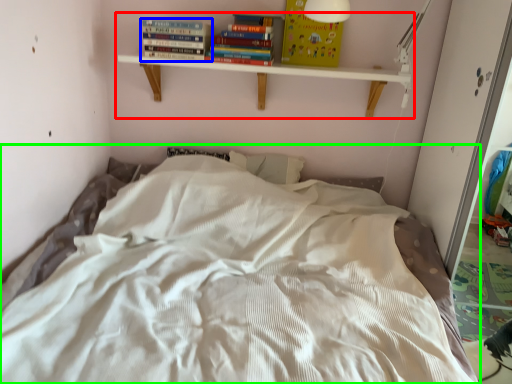
Question: Which object is positioned farthest from shelf (highlighted by a red box)? Select from book (highlighted by a blue box) and bed (highlighted by a green box).

Choices:
 (A) book
 (B) bed

Answer: (B)